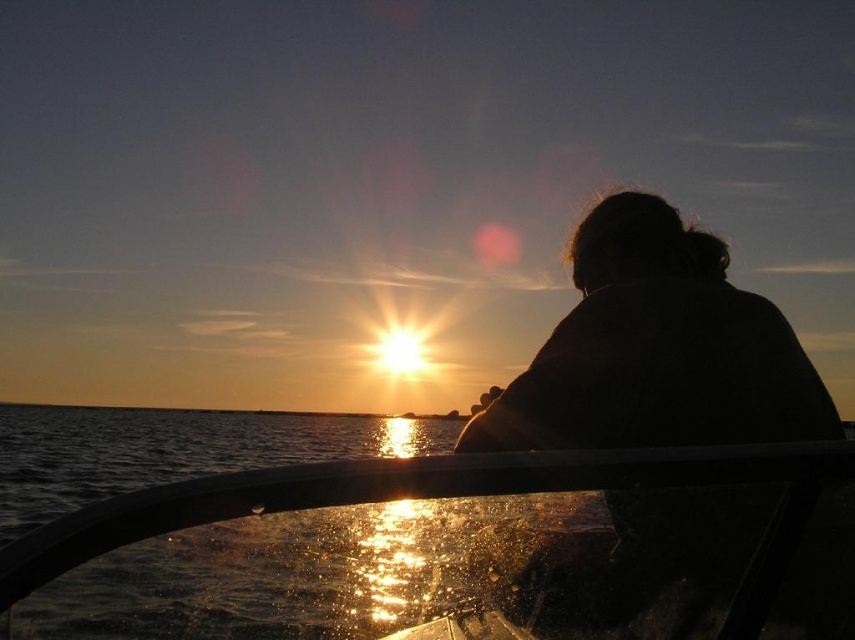
You are standing on the deck of the transparent glass boat at center and want to take a photo of the silhouette at center. Since the silhouette is smaller than the boat, will it fit entirely within the camera frame if you zoom out to the widest setting?

The silhouette at center is smaller in width than the transparent glass boat at center. Since the silhouette is narrower, it should fit within the camera frame when zoomed out to the widest setting.